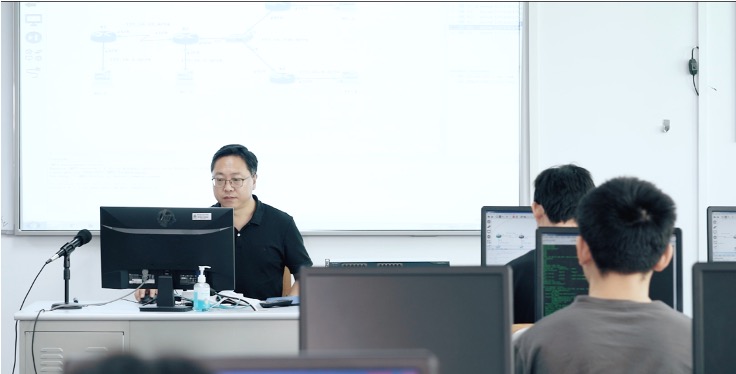
I want to click on white board, so click(368, 143), click(592, 115).